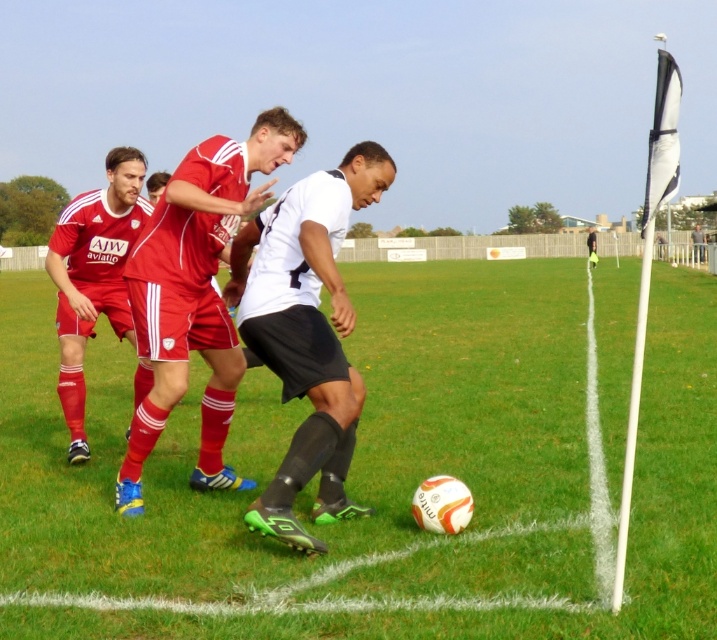
Question: Which of the following is the closest to the observer?

Choices:
 (A) matte red shorts at center
 (B) white matte soccer ball at center
 (C) black matte shorts at center

Answer: (B)

Question: Can you confirm if matte red shorts at center is wider than matte red soccer jersey at left?

Choices:
 (A) yes
 (B) no

Answer: (B)

Question: Considering the real-world distances, which object is farthest from the black matte shorts at center?

Choices:
 (A) matte red shorts at center
 (B) matte red soccer jersey at left
 (C) white matte soccer ball at center

Answer: (C)

Question: Can you confirm if black matte shorts at center is positioned below matte red soccer jersey at left?

Choices:
 (A) yes
 (B) no

Answer: (A)

Question: Can you confirm if black matte shorts at center is thinner than matte red soccer jersey at left?

Choices:
 (A) no
 (B) yes

Answer: (B)

Question: Which is nearer to the white matte soccer ball at center?

Choices:
 (A) matte red soccer jersey at left
 (B) matte red shorts at center

Answer: (A)